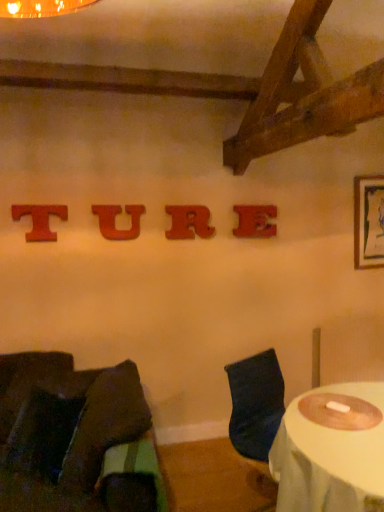
The width and height of the screenshot is (384, 512). What do you see at coordinates (115, 219) in the screenshot?
I see `wooden letter u at center, which is the 2th alphabet from left to right` at bounding box center [115, 219].

This screenshot has height=512, width=384. What do you see at coordinates (331, 450) in the screenshot? I see `white fabric-covered table at lower right` at bounding box center [331, 450].

Find the location of `white fabric-covered table at lower right`. white fabric-covered table at lower right is located at coordinates (331, 450).

In order to face wooden letter e at center, which is the 4th alphabet in left-to-right order, should I rotate leftwards or rightwards?

To face it directly, rotate right by 8.537 degrees.

The width and height of the screenshot is (384, 512). Describe the element at coordinates (368, 221) in the screenshot. I see `wooden frame at upper right` at that location.

Describe the element at coordinates (40, 220) in the screenshot. I see `red wood letter t at upper center, which is the first alphabet from left to right` at that location.

At what (x,y) coordinates should I click in order to perform the action: click on velvet dark brown chair at lower left, which ranks as the 1th chair in left-to-right order. Please return your answer as a coordinate pair (x, y). The width and height of the screenshot is (384, 512). Looking at the image, I should click on coord(75,438).

This screenshot has width=384, height=512. Identify the location of wooden letter u at center, which is the 2th alphabet from left to right. (115, 219).

Visually, is dark blue fabric chair at lower right, which ranks as the second chair in left-to-right order, positioned to the left or to the right of wooden frame at upper right?

In the image, dark blue fabric chair at lower right, which ranks as the second chair in left-to-right order, appears on the left side of wooden frame at upper right.

Between point (249, 369) and point (365, 249), which one is positioned behind?

Point (365, 249)

How far apart are dark blue fabric chair at lower right, which ranks as the 1th chair in right-to-left order, and wooden frame at upper right?

dark blue fabric chair at lower right, which ranks as the 1th chair in right-to-left order, is 4.87 feet away from wooden frame at upper right.

From a real-world perspective, is dark blue fabric chair at lower right, which ranks as the second chair in left-to-right order, located beneath wooden frame at upper right?

Indeed, from a real-world perspective, dark blue fabric chair at lower right, which ranks as the second chair in left-to-right order, is positioned beneath wooden frame at upper right.

From a real-world perspective, which alphabet is the 2nd one above the wooden letter e at center, which is the 4th alphabet in left-to-right order? Please provide its 2D coordinates.

[(189, 222)]

Considering the sizes of wooden letter e at center, which is the 4th alphabet in left-to-right order, and wooden letter r at center, the 2th alphabet when ordered from right to left, in the image, is wooden letter e at center, which is the 4th alphabet in left-to-right order, wider or thinner than wooden letter r at center, the 2th alphabet when ordered from right to left,?

Considering their sizes, wooden letter e at center, which is the 4th alphabet in left-to-right order, looks broader than wooden letter r at center, the 2th alphabet when ordered from right to left.

In the scene shown: Is wooden letter e at center, the first alphabet viewed from the right, far from wooden letter r at center, the 2th alphabet when ordered from right to left?

wooden letter e at center, the first alphabet viewed from the right, is near wooden letter r at center, the 2th alphabet when ordered from right to left, not far away.

Is red wood letter t at upper center, which is the first alphabet from left to right, spatially inside white fabric-covered table at lower right, or outside of it?

red wood letter t at upper center, which is the first alphabet from left to right, exists outside the volume of white fabric-covered table at lower right.

Are red wood letter t at upper center, which is the first alphabet from left to right, and white fabric-covered table at lower right located far from each other?

Indeed, red wood letter t at upper center, which is the first alphabet from left to right, is not near white fabric-covered table at lower right.

Which is behind, point (33, 214) or point (360, 459)?

Point (33, 214)

Which is closer, (184,229) or (379,446)?

Point (184,229) appears to be farther away from the viewer than point (379,446).

From the picture: Can you confirm if wooden letter r at center, the 2th alphabet when ordered from right to left, is taller than white fabric-covered table at lower right?

Incorrect, the height of wooden letter r at center, the 2th alphabet when ordered from right to left, is not larger of that of white fabric-covered table at lower right.

The height and width of the screenshot is (512, 384). Find the location of `the 3rd alphabet behind the white fabric-covered table at lower right, starting your count from the anchor`. the 3rd alphabet behind the white fabric-covered table at lower right, starting your count from the anchor is located at coordinates (189, 222).

Would you say wooden letter r at center, which is the third alphabet from left to right, contains velvet dark brown chair at lower left, which ranks as the 1th chair in left-to-right order?

No.

Does point (185, 212) come behind point (33, 439)?

Yes, it is behind point (33, 439).

Which of these two, wooden letter r at center, which is the third alphabet from left to right, or velvet dark brown chair at lower left, the second chair from the right, is smaller?

Smaller between the two is wooden letter r at center, which is the third alphabet from left to right.

Can you see wooden letter r at center, the 2th alphabet when ordered from right to left, touching velvet dark brown chair at lower left, which ranks as the 1th chair in left-to-right order?

Result: No, wooden letter r at center, the 2th alphabet when ordered from right to left, is not with velvet dark brown chair at lower left, which ranks as the 1th chair in left-to-right order.

Is wooden letter r at center, which is the third alphabet from left to right, located outside wooden letter e at center, the first alphabet viewed from the right?

wooden letter r at center, which is the third alphabet from left to right, lies outside wooden letter e at center, the first alphabet viewed from the right,'s area.

Is wooden letter r at center, which is the third alphabet from left to right, not close to wooden letter e at center, the first alphabet viewed from the right?

No, wooden letter r at center, which is the third alphabet from left to right, is in close proximity to wooden letter e at center, the first alphabet viewed from the right.

Find the location of a particular element. The image size is (384, 512). the 2nd alphabet positioned below the wooden letter r at center, the 2th alphabet when ordered from right to left (from a real-world perspective) is located at coordinates (255, 221).

Based on their sizes in the image, would you say wooden letter r at center, which is the third alphabet from left to right, is bigger or smaller than wooden letter e at center, the first alphabet viewed from the right?

In the image, wooden letter r at center, which is the third alphabet from left to right, appears to be larger than wooden letter e at center, the first alphabet viewed from the right.

From a real-world perspective, count 1st alphabets upward from the wooden letter u at center, the 3th alphabet in the right-to-left sequence, and point to it. Please provide its 2D coordinates.

[(189, 222)]

Is wooden letter u at center, which is the 2th alphabet from left to right, located within wooden letter r at center, the 2th alphabet when ordered from right to left?

Definitely not — wooden letter u at center, which is the 2th alphabet from left to right, is not inside wooden letter r at center, the 2th alphabet when ordered from right to left.

Considering the sizes of wooden letter r at center, the 2th alphabet when ordered from right to left, and wooden letter u at center, which is the 2th alphabet from left to right, in the image, is wooden letter r at center, the 2th alphabet when ordered from right to left, wider or thinner than wooden letter u at center, which is the 2th alphabet from left to right,?

In the image, wooden letter r at center, the 2th alphabet when ordered from right to left, appears to be wider than wooden letter u at center, which is the 2th alphabet from left to right.

Is wooden letter r at center, which is the third alphabet from left to right, not close to wooden letter u at center, the 3th alphabet in the right-to-left sequence?

No, there isn't a large distance between wooden letter r at center, which is the third alphabet from left to right, and wooden letter u at center, the 3th alphabet in the right-to-left sequence.

From the image's perspective, starting from the wooden frame at upper right, which chair is the 2nd one below? Please provide its 2D coordinates.

[(255, 404)]

The image size is (384, 512). I want to click on the 2nd alphabet directly beneath the wooden letter r at center, the 2th alphabet when ordered from right to left (from a real-world perspective), so click(255, 221).

Looking at the image, which one is located closer to white fabric-covered table at lower right, wooden letter u at center, which is the 2th alphabet from left to right, or wooden letter r at center, the 2th alphabet when ordered from right to left?

wooden letter r at center, the 2th alphabet when ordered from right to left, lies closer to white fabric-covered table at lower right than the other object.

Considering their positions, is wooden letter r at center, which is the third alphabet from left to right, positioned closer to velvet dark brown chair at lower left, the second chair from the right, than white fabric-covered table at lower right?

white fabric-covered table at lower right is closer to velvet dark brown chair at lower left, the second chair from the right.

Which object lies nearer to the anchor point red wood letter t at upper center, which is the first alphabet from left to right, dark blue fabric chair at lower right, which ranks as the second chair in left-to-right order, or wooden frame at upper right?

dark blue fabric chair at lower right, which ranks as the second chair in left-to-right order, is closer to red wood letter t at upper center, which is the first alphabet from left to right.

Looking at the image, which one is located further to wooden frame at upper right, dark blue fabric chair at lower right, which ranks as the 1th chair in right-to-left order, or wooden letter r at center, which is the third alphabet from left to right?

dark blue fabric chair at lower right, which ranks as the 1th chair in right-to-left order.

Which object lies further to the anchor point wooden letter e at center, the first alphabet viewed from the right, dark blue fabric chair at lower right, which ranks as the second chair in left-to-right order, or wooden letter u at center, the 3th alphabet in the right-to-left sequence?

Among the two, dark blue fabric chair at lower right, which ranks as the second chair in left-to-right order, is located further to wooden letter e at center, the first alphabet viewed from the right.

From the image, which object appears to be farther from wooden frame at upper right, wooden letter e at center, which is the 4th alphabet in left-to-right order, or dark blue fabric chair at lower right, which ranks as the second chair in left-to-right order?

dark blue fabric chair at lower right, which ranks as the second chair in left-to-right order, lies further to wooden frame at upper right than the other object.

Considering their positions, is wooden letter e at center, the first alphabet viewed from the right, positioned closer to velvet dark brown chair at lower left, the second chair from the right, than red wood letter t at upper center, which is the first alphabet from left to right?

The object closer to velvet dark brown chair at lower left, the second chair from the right, is red wood letter t at upper center, which is the first alphabet from left to right.

Which object lies nearer to the anchor point dark blue fabric chair at lower right, which ranks as the 1th chair in right-to-left order, wooden frame at upper right or wooden letter e at center, the first alphabet viewed from the right?

wooden letter e at center, the first alphabet viewed from the right, is positioned closer to the anchor dark blue fabric chair at lower right, which ranks as the 1th chair in right-to-left order.

You are a GUI agent. You are given a task and a screenshot of the screen. Output one action in this format:
    pyautogui.click(x=<x>, y=<y>)
    Task: Click on the alphabet between wooden letter u at center, the 3th alphabet in the right-to-left sequence, and wooden letter e at center, the first alphabet viewed from the right
    The image size is (384, 512).
    Given the screenshot: What is the action you would take?
    pyautogui.click(x=189, y=222)

Where is `chair located between velvet dark brown chair at lower left, which ranks as the 1th chair in left-to-right order, and white fabric-covered table at lower right in the left-right direction`? chair located between velvet dark brown chair at lower left, which ranks as the 1th chair in left-to-right order, and white fabric-covered table at lower right in the left-right direction is located at coordinates (255, 404).

Locate an element on the screen. The height and width of the screenshot is (512, 384). chair between wooden letter r at center, the 2th alphabet when ordered from right to left, and dark blue fabric chair at lower right, which ranks as the 1th chair in right-to-left order, vertically is located at coordinates (75, 438).

Find the location of a particular element. chair located between velvet dark brown chair at lower left, the second chair from the right, and wooden letter e at center, the first alphabet viewed from the right, in the left-right direction is located at coordinates (255, 404).